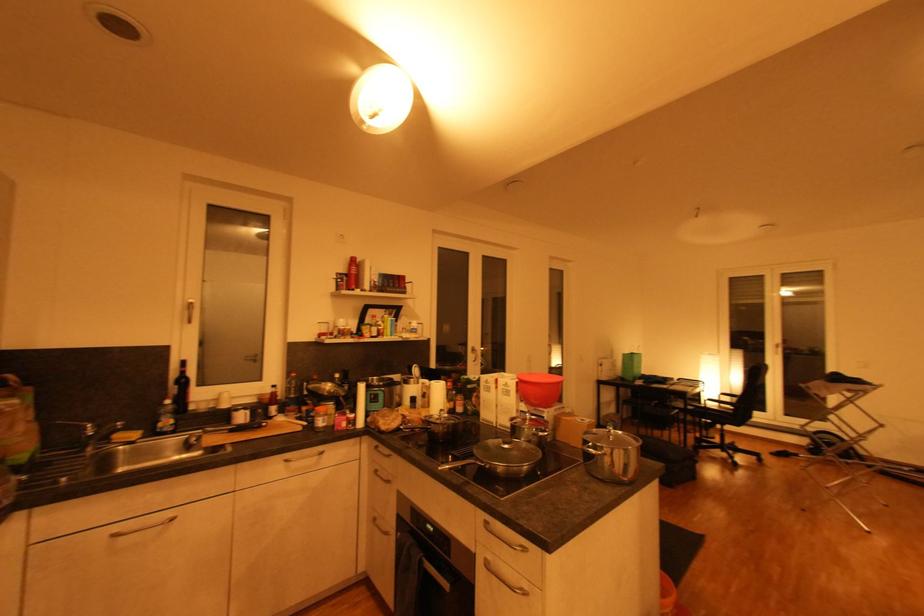
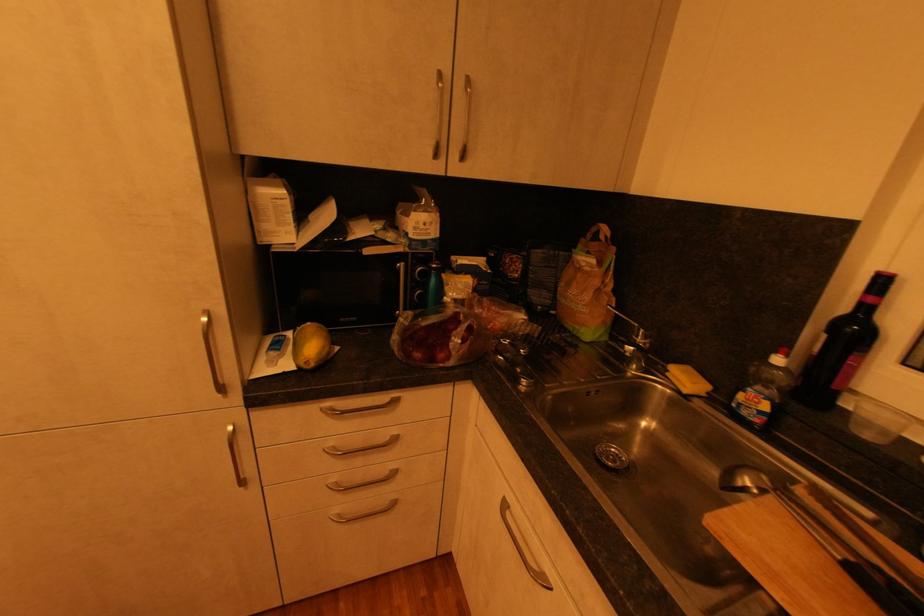
In the second image, find the point that corresponds to (116,440) in the first image.

(672, 371)